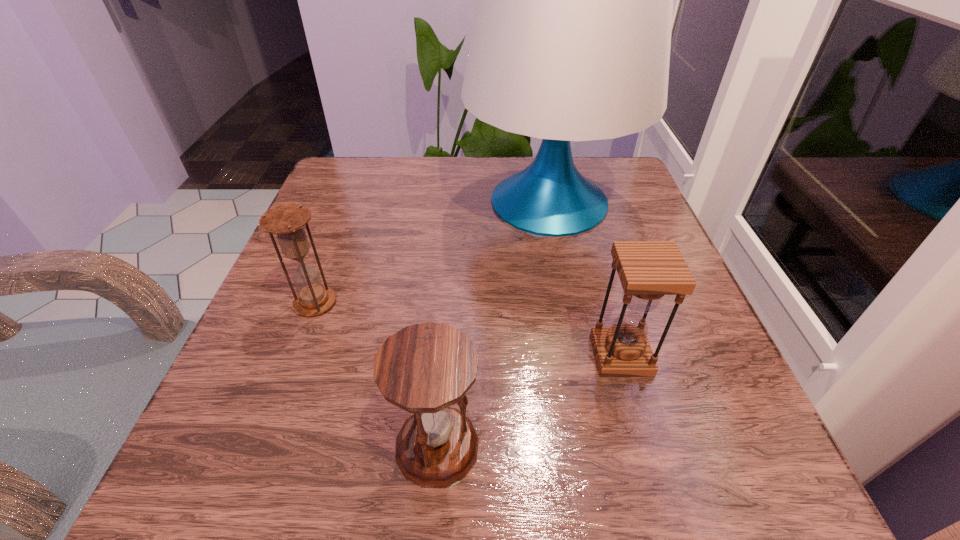
In the image, there is a desktop. At what (x,y) coordinates should I click in order to perform the action: click on vacant space at the far edge. Please return your answer as a coordinate pair (x, y). The image size is (960, 540). Looking at the image, I should click on (513, 171).

Locate an element on the screen. vacant space at the near edge is located at coordinates (345, 451).

Where is `free space at the left edge of the desktop`? free space at the left edge of the desktop is located at coordinates [357, 246].

This screenshot has height=540, width=960. What are the coordinates of `vacant region at the right edge of the desktop` in the screenshot? It's located at (651, 440).

Where is `blank area at the far left corner`? This screenshot has width=960, height=540. blank area at the far left corner is located at coordinates (331, 195).

In the image, there is a desktop. Identify the location of free space at the near right corner. The height and width of the screenshot is (540, 960). (688, 443).

You are a GUI agent. You are given a task and a screenshot of the screen. Output one action in this format:
    pyautogui.click(x=<x>, y=<y>)
    Task: Click on the free space that is in between the farthest object and the second hourglass from left to right
    
    Given the screenshot: What is the action you would take?
    pyautogui.click(x=493, y=324)

Locate an element on the screen. This screenshot has height=540, width=960. blank region between the tallest object and the second nearest hourglass is located at coordinates (585, 278).

At what (x,y) coordinates should I click in order to perform the action: click on free space between the second hourglass from right to left and the tallest object. Please return your answer as a coordinate pair (x, y). The image size is (960, 540). Looking at the image, I should click on (493, 324).

At what (x,y) coordinates should I click in order to perform the action: click on vacant space that is in between the leftmost object and the farthest object. Please return your answer as a coordinate pair (x, y). Looking at the image, I should click on (432, 252).